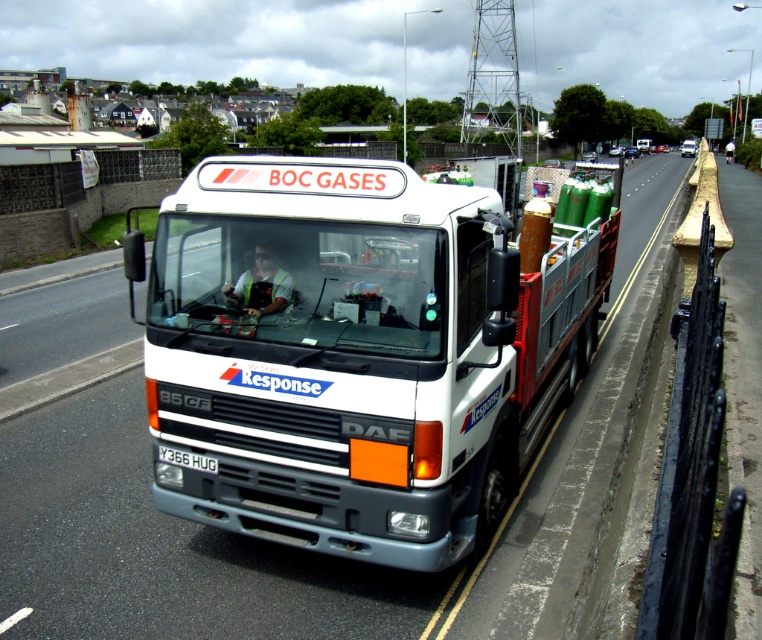
Question: Which object appears closest to the camera in this image?

Choices:
 (A) white matte truck at center
 (B) white plastic license plate at center

Answer: (A)

Question: Can you confirm if white matte truck at center is bigger than white plastic license plate at center?

Choices:
 (A) yes
 (B) no

Answer: (A)

Question: Does white matte truck at center have a smaller size compared to white plastic license plate at center?

Choices:
 (A) no
 (B) yes

Answer: (A)

Question: Is white matte truck at center thinner than white plastic license plate at center?

Choices:
 (A) no
 (B) yes

Answer: (A)